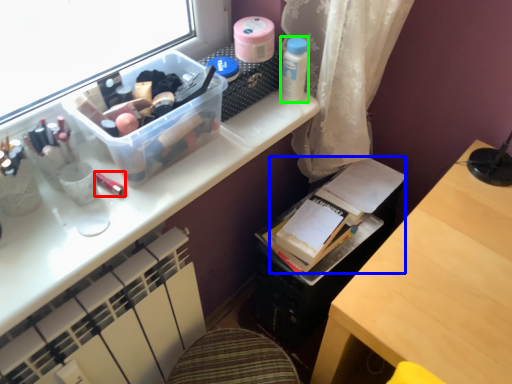
Question: Estimate the real-world distances between objects in this image. Which object is closer to toiletry (highlighted by a red box), book (highlighted by a blue box) or toiletry (highlighted by a green box)?

Choices:
 (A) book
 (B) toiletry

Answer: (B)